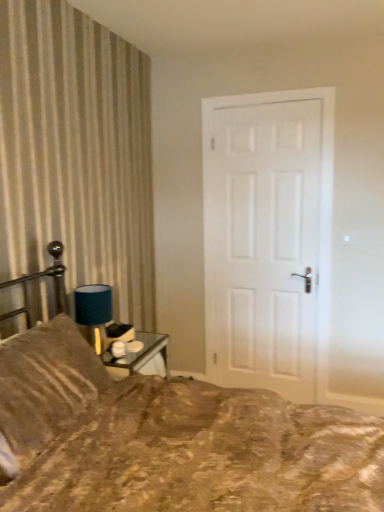
Question: Is blue fabric lampshade at upper left not near white matte door at center?

Choices:
 (A) yes
 (B) no

Answer: (A)

Question: Is the depth of blue fabric lampshade at upper left greater than that of white matte door at center?

Choices:
 (A) yes
 (B) no

Answer: (B)

Question: From the image's perspective, would you say blue fabric lampshade at upper left is positioned over white matte door at center?

Choices:
 (A) yes
 (B) no

Answer: (B)

Question: From a real-world perspective, is blue fabric lampshade at upper left on white matte door at center?

Choices:
 (A) no
 (B) yes

Answer: (A)

Question: Is blue fabric lampshade at upper left smaller than white matte door at center?

Choices:
 (A) no
 (B) yes

Answer: (B)

Question: Does blue fabric lampshade at upper left turn towards white matte door at center?

Choices:
 (A) yes
 (B) no

Answer: (B)

Question: Does brown textured fabric bed at lower left turn towards brown textured pillow at left?

Choices:
 (A) yes
 (B) no

Answer: (B)

Question: From a real-world perspective, does brown textured fabric bed at lower left sit lower than brown textured pillow at left?

Choices:
 (A) no
 (B) yes

Answer: (B)

Question: Can you confirm if brown textured fabric bed at lower left is smaller than brown textured pillow at left?

Choices:
 (A) yes
 (B) no

Answer: (B)

Question: Is brown textured fabric bed at lower left turned away from brown textured pillow at left?

Choices:
 (A) yes
 (B) no

Answer: (A)

Question: Considering the relative sizes of brown textured fabric bed at lower left and brown textured pillow at left in the image provided, is brown textured fabric bed at lower left wider than brown textured pillow at left?

Choices:
 (A) yes
 (B) no

Answer: (A)

Question: From the image's perspective, is brown textured fabric bed at lower left beneath brown textured pillow at left?

Choices:
 (A) yes
 (B) no

Answer: (A)

Question: Considering the relative positions of brown textured pillow at left and brown textured fabric bed at lower left in the image provided, is brown textured pillow at left behind brown textured fabric bed at lower left?

Choices:
 (A) no
 (B) yes

Answer: (B)